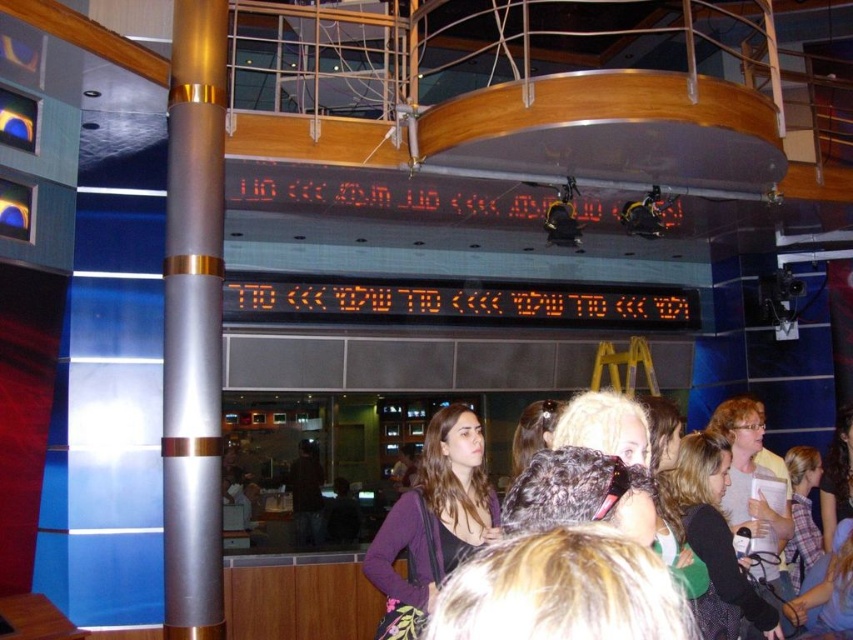
You are standing in the studio and want to move from the point closer to you to the point further away. Which path should you take to go from the point at coordinates point (167, 234) to the point at coordinates point (558, 308)?

The path you should take is moving from point (167, 234) to point (558, 308) since point (167, 234) is closer to the viewer and point (558, 308) is further away.

You are standing in the studio and want to take a photo of the blonde hair at center without getting too close. The camera you have can focus clearly up to 15 feet. Will you be able to capture a clear photo from your current position?

The blonde hair at center and viewer are 14.55 feet apart from each other. Since the camera can focus up to 15 feet, you can capture a clear photo from your current position as the distance is within the camera range.